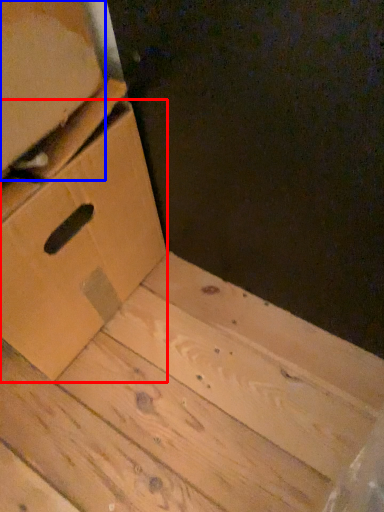
Question: Among these objects, which one is nearest to the camera, drawer (highlighted by a red box) or cardboard box (highlighted by a blue box)?

Choices:
 (A) drawer
 (B) cardboard box

Answer: (B)